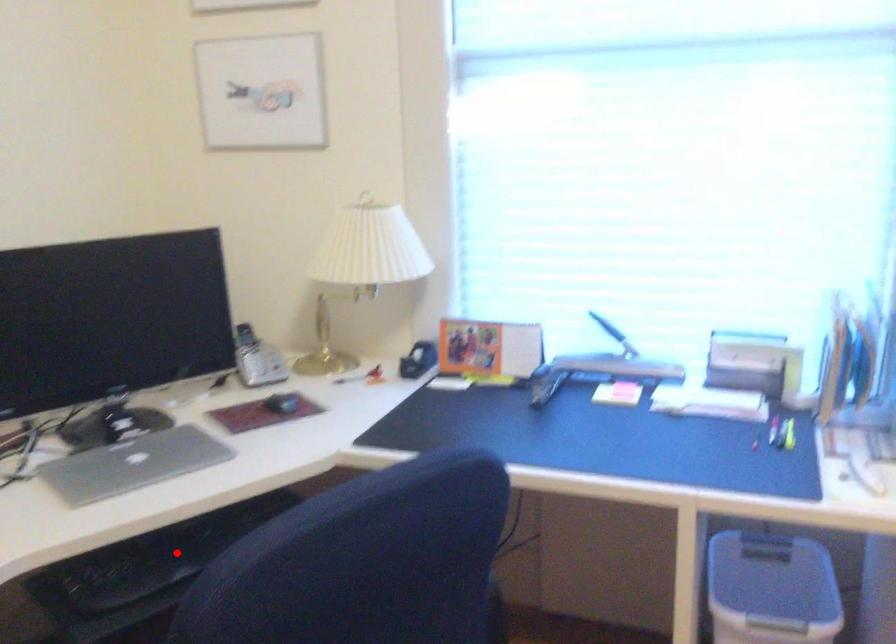
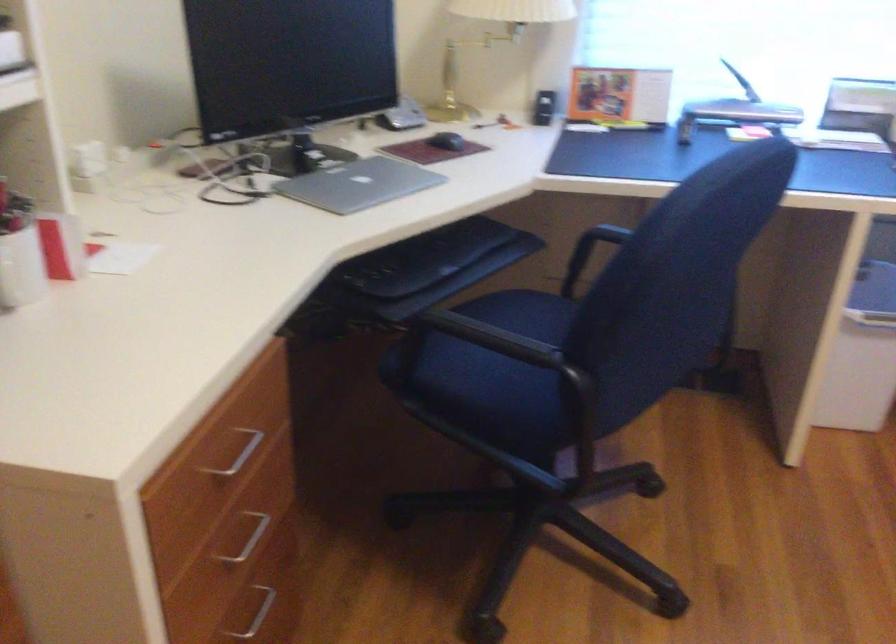
Question: I am providing you with two images of the same scene from different viewpoints. A red point is shown in image1. For the corresponding object point in image2, is it positioned nearer or farther from the camera?

Choices:
 (A) Nearer
 (B) Farther

Answer: (B)